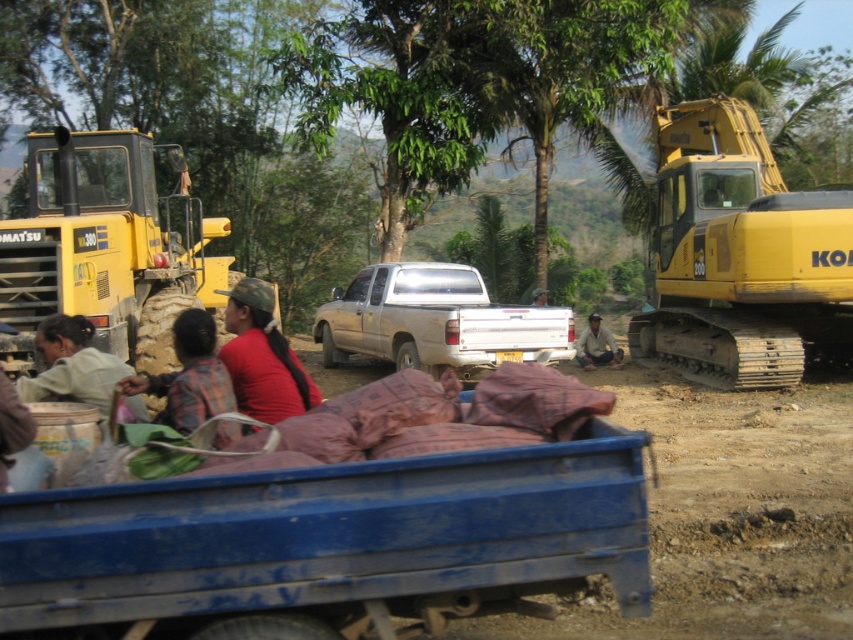
You are a safety inspector at the construction site. You need to ensure that the yellow metallic excavator at right can lower its bucket to the ground without hitting the camo fabric cap at center. Based on their heights, is this possible?

The yellow metallic excavator at right has a lesser height compared to camo fabric cap at center, so the excavator cannot lower its bucket to the ground without hitting the camo fabric cap at center.

You are standing at the construction site and want to move from your current position to the yellow metallic excavator at right. The safety regulations state that you must maintain a minimum distance of 10 meters from any heavy machinery. Can you safely approach the excavator without violating the safety rules?

The distance between you and the yellow metallic excavator at right is 15.40 meters, which is greater than the required 10 meters. Therefore, you can safely approach the excavator without violating the safety regulations.

You are standing at the center of the construction site. There is a point marked at coordinates (741, 257). What object is located at that point?

The yellow metallic excavator at right is located at point (741, 257).